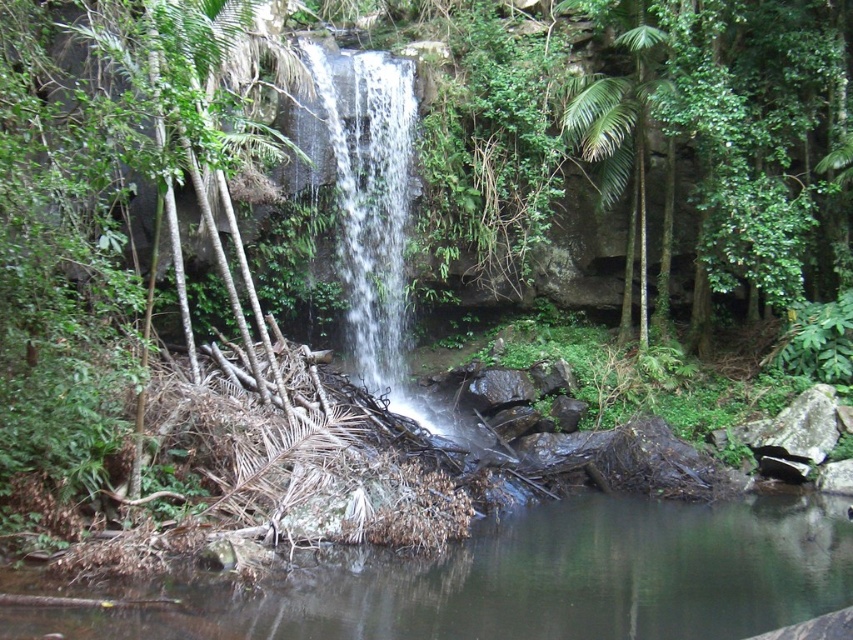
Who is taller, green mossy log at lower center or clear water at center?

Standing taller between the two is clear water at center.

In the scene shown: Does green mossy log at lower center have a larger size compared to clear water at center?

Yes, green mossy log at lower center is bigger than clear water at center.

Which is behind, point (769, 502) or point (312, 77)?

Positioned behind is point (312, 77).

This screenshot has height=640, width=853. In order to click on green mossy log at lower center in this screenshot , I will do `click(535, 580)`.